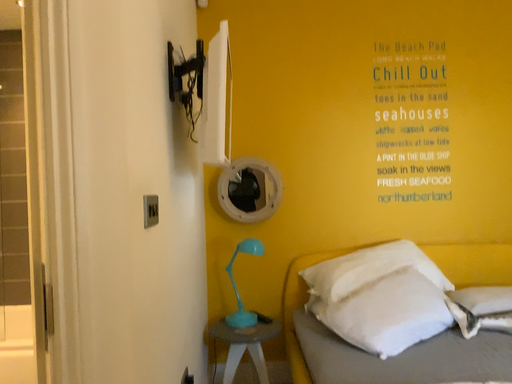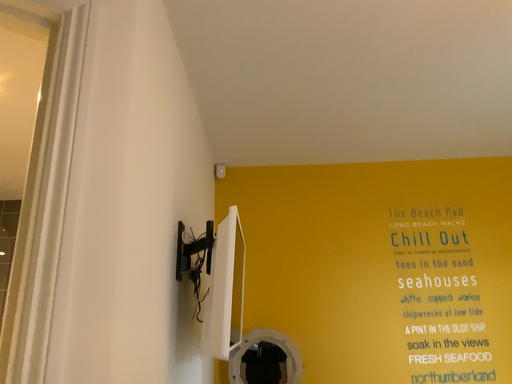
Question: Which way did the camera rotate in the video?

Choices:
 (A) rotated upward
 (B) rotated downward

Answer: (A)